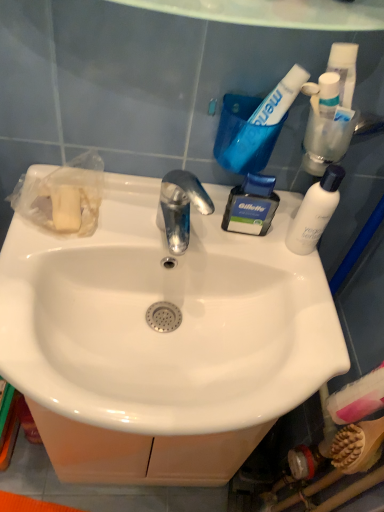
The image size is (384, 512). In order to click on vacant space to the left of blue plastic shaving cream at upper right, marked as the second toiletry in a top-to-bottom arrangement in this screenshot , I will do `click(158, 226)`.